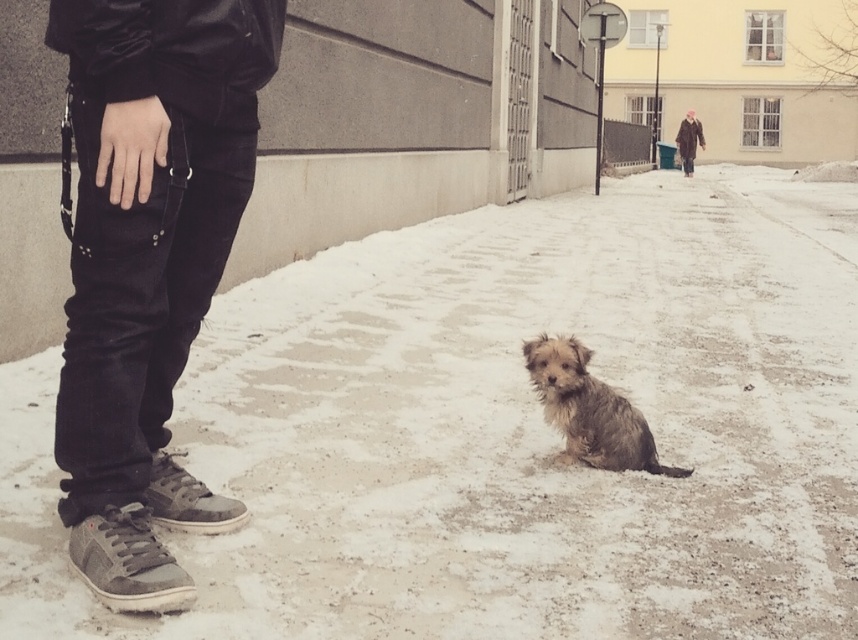
Who is lower down, white powdery snow at lower center or brown leather coat at upper right?

white powdery snow at lower center

Can you confirm if white powdery snow at lower center is positioned above brown leather coat at upper right?

Incorrect, white powdery snow at lower center is not positioned above brown leather coat at upper right.

At what (x,y) coordinates should I click in order to perform the action: click on white powdery snow at lower center. Please return your answer as a coordinate pair (x, y). The width and height of the screenshot is (858, 640). Looking at the image, I should click on (505, 429).

Does point (97, 148) come in front of point (583, 362)?

That is True.

Does black leather pants at lower left appear on the left side of fuzzy brown dog at center?

Yes, black leather pants at lower left is to the left of fuzzy brown dog at center.

The image size is (858, 640). In order to click on black leather pants at lower left in this screenshot , I will do `click(148, 262)`.

Who is positioned more to the right, white powdery snow at lower center or black leather pants at lower left?

white powdery snow at lower center is more to the right.

Is white powdery snow at lower center to the left of black leather pants at lower left from the viewer's perspective?

In fact, white powdery snow at lower center is to the right of black leather pants at lower left.

Between point (276, 321) and point (239, 205), which one is positioned behind?

The point (276, 321) is more distant.

At what (x,y) coordinates should I click in order to perform the action: click on white powdery snow at lower center. Please return your answer as a coordinate pair (x, y). The width and height of the screenshot is (858, 640). Looking at the image, I should click on (505, 429).